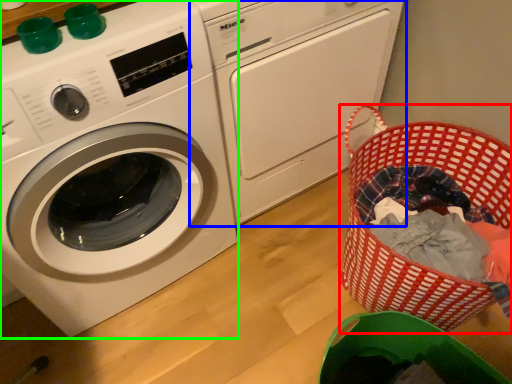
Question: Which object is the farthest from basket (highlighted by a red box)? Choose among these: washing machine (highlighted by a blue box) or washing machine (highlighted by a green box).

Choices:
 (A) washing machine
 (B) washing machine

Answer: (B)